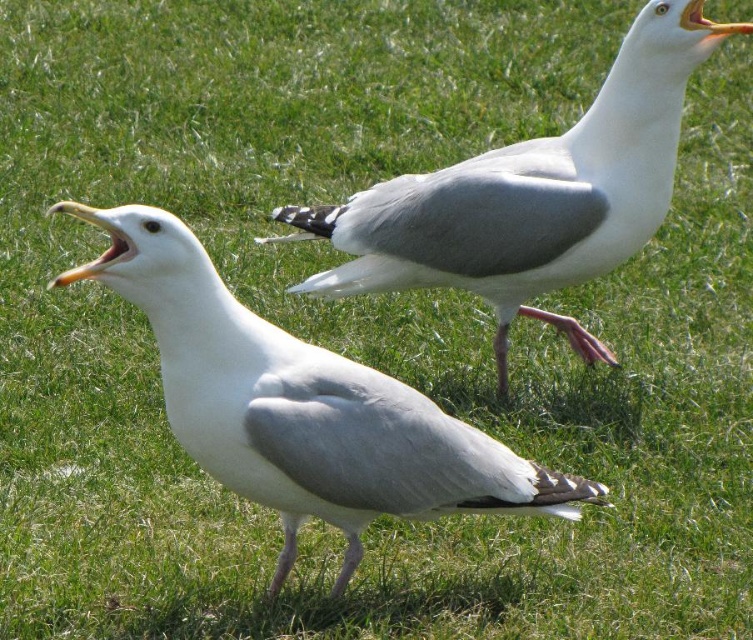
You are a birdwatcher trying to observe both seagulls in the image. Which seagull is closer to you, the white matte seagull at center or the white matte seagull at upper center?

The white matte seagull at center is closer to you because it is positioned under the white matte seagull at upper center, meaning the upper one is farther away.

You are a birdwatcher trying to identify the positions of two seagulls in the image. According to their coordinates, which seagull is closer to you, the one at point (584, 500) or the one at point (599, 108)?

The seagull at point (584, 500) is closer to you because it is positioned in front of the seagull at point (599, 108).